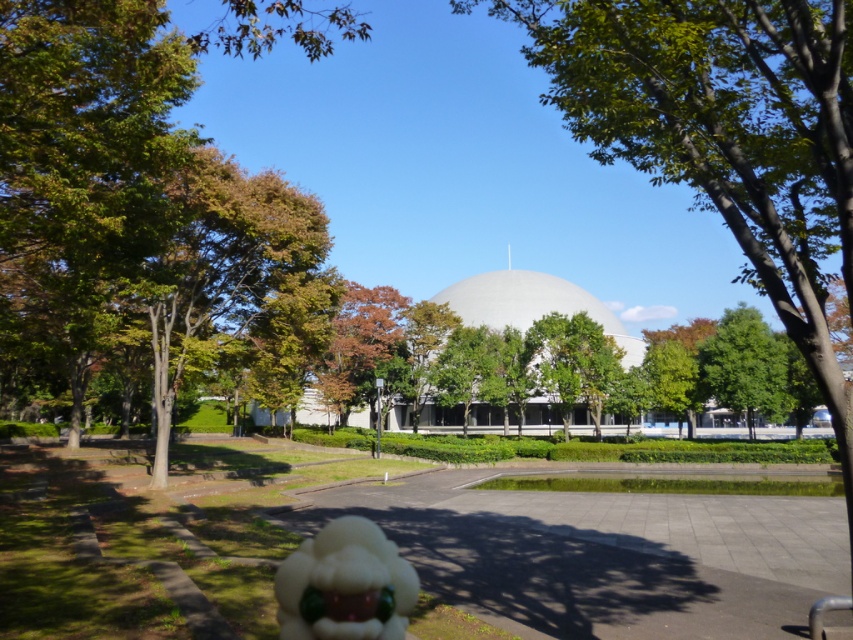
Question: Which object is the closest to the white smooth dome at center?

Choices:
 (A) green leafy tree at right
 (B) white fluffy toy at lower center

Answer: (A)

Question: Among these points, which one is farthest from the camera?

Choices:
 (A) (727, 348)
 (B) (383, 625)
 (C) (492, 269)

Answer: (C)

Question: Among these objects, which one is farthest from the camera?

Choices:
 (A) green leafy tree at right
 (B) white smooth dome at center
 (C) white fluffy toy at lower center

Answer: (B)

Question: Where is white fluffy toy at lower center located in relation to white smooth dome at center in the image?

Choices:
 (A) above
 (B) below

Answer: (B)

Question: In this image, where is white fluffy toy at lower center located relative to green leafy tree at right?

Choices:
 (A) right
 (B) left

Answer: (B)

Question: In this image, where is white fluffy toy at lower center located relative to white smooth dome at center?

Choices:
 (A) below
 (B) above

Answer: (A)